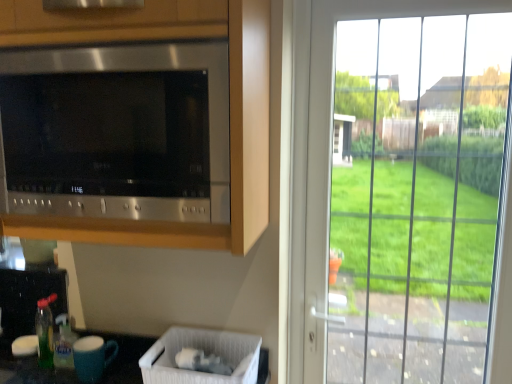
Question: Considering the relative sizes of stainless steel microwave at upper left and clear glass door at right in the image provided, is stainless steel microwave at upper left smaller than clear glass door at right?

Choices:
 (A) no
 (B) yes

Answer: (A)

Question: Are stainless steel microwave at upper left and clear glass door at right beside each other?

Choices:
 (A) no
 (B) yes

Answer: (A)

Question: From a real-world perspective, is stainless steel microwave at upper left located beneath clear glass door at right?

Choices:
 (A) yes
 (B) no

Answer: (B)

Question: Is stainless steel microwave at upper left at the right side of clear glass door at right?

Choices:
 (A) yes
 (B) no

Answer: (B)

Question: Could clear glass door at right be considered to be inside stainless steel microwave at upper left?

Choices:
 (A) yes
 (B) no

Answer: (B)

Question: Does stainless steel microwave at upper left have a lesser height compared to clear glass door at right?

Choices:
 (A) no
 (B) yes

Answer: (B)

Question: Is blue matte mug at lower left positioned behind clear glass door at right?

Choices:
 (A) no
 (B) yes

Answer: (B)

Question: Is blue matte mug at lower left smaller than clear glass door at right?

Choices:
 (A) yes
 (B) no

Answer: (A)

Question: Are blue matte mug at lower left and clear glass door at right located far from each other?

Choices:
 (A) yes
 (B) no

Answer: (B)

Question: Does blue matte mug at lower left have a greater height compared to clear glass door at right?

Choices:
 (A) no
 (B) yes

Answer: (A)

Question: Does blue matte mug at lower left contain clear glass door at right?

Choices:
 (A) yes
 (B) no

Answer: (B)

Question: Is blue matte mug at lower left at the right side of clear glass door at right?

Choices:
 (A) yes
 (B) no

Answer: (B)

Question: Can you confirm if white plastic laundry basket at lower center is smaller than blue matte mug at lower left?

Choices:
 (A) yes
 (B) no

Answer: (B)